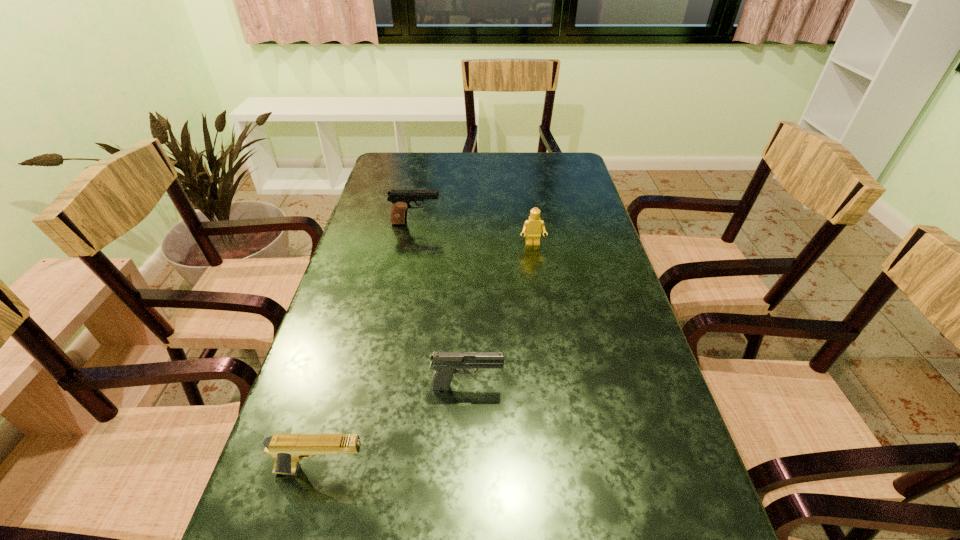
The image size is (960, 540). I want to click on blank space that satisfies the following two spatial constraints: 1. on the face of the second farthest object; 2. at the barrel of the nearest object, so click(566, 470).

This screenshot has width=960, height=540. I want to click on blank area in the image that satisfies the following two spatial constraints: 1. on the face of the rightmost object; 2. aim along the barrel of the second farthest pistol, so click(x=554, y=386).